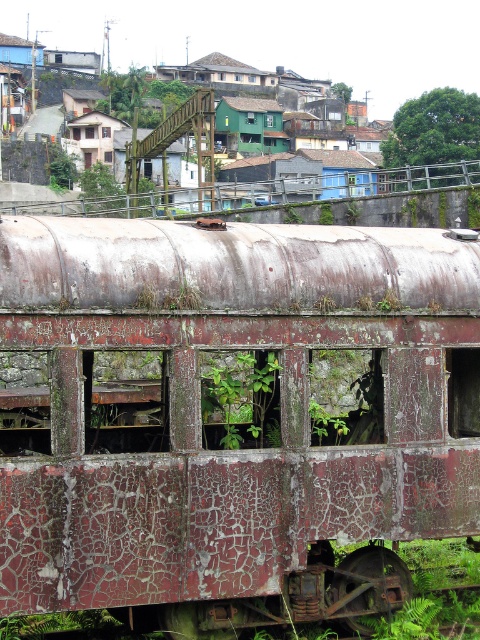
Between rusty metal train at center and green leafy plant at center, which one appears on the left side from the viewer's perspective?

From the viewer's perspective, rusty metal train at center appears more on the left side.

In the scene shown: Can you confirm if rusty metal train at center is smaller than green leafy plant at center?

Actually, rusty metal train at center might be larger than green leafy plant at center.

Where is `rusty metal train at center`? rusty metal train at center is located at coordinates (202, 420).

Who is higher up, rusty metal train at center or green leafy tree at upper right?

green leafy tree at upper right is above.

Is point (227, 460) closer to camera compared to point (457, 154)?

Yes, point (227, 460) is closer to viewer.

The width and height of the screenshot is (480, 640). I want to click on rusty metal train at center, so click(x=202, y=420).

Can you confirm if green leafy plant at center is positioned to the right of green leafy tree at upper right?

In fact, green leafy plant at center is to the left of green leafy tree at upper right.

Does point (248, 392) come in front of point (414, 104)?

Yes, it is.

You are a GUI agent. You are given a task and a screenshot of the screen. Output one action in this format:
    pyautogui.click(x=<x>, y=<y>)
    Task: Click on the green leafy plant at center
    Image resolution: width=480 pixels, height=640 pixels.
    Given the screenshot: What is the action you would take?
    pyautogui.click(x=240, y=400)